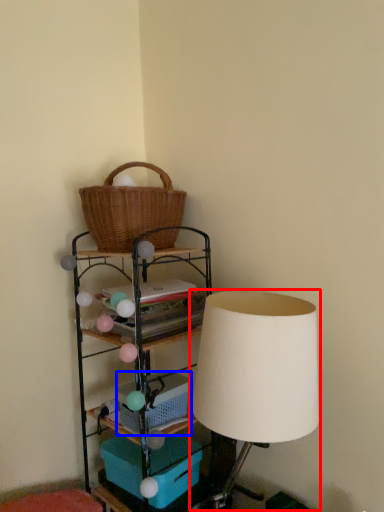
Question: Which point is further to the camera, table lamp (highlighted by a red box) or basket (highlighted by a blue box)?

Choices:
 (A) table lamp
 (B) basket

Answer: (B)